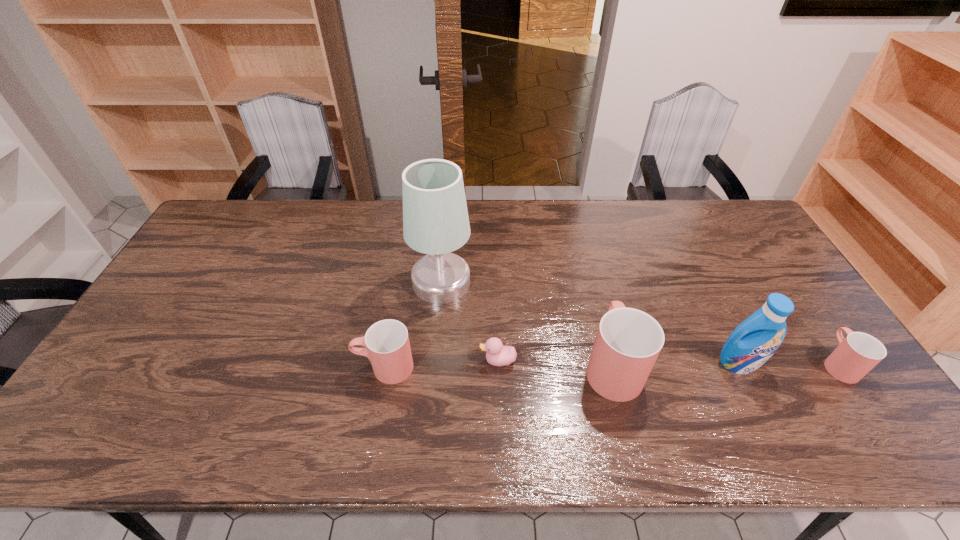
Locate an element on the screen. The image size is (960, 540). the leftmost cup is located at coordinates (387, 346).

I want to click on the fourth tallest object, so [x=387, y=346].

Where is `the fourth shortest object`? This screenshot has width=960, height=540. the fourth shortest object is located at coordinates [x=628, y=342].

Identify the location of the tallest cup. (628, 342).

You are a GUI agent. You are given a task and a screenshot of the screen. Output one action in this format:
    pyautogui.click(x=<x>, y=<y>)
    Task: Click on the shortest cup
    The width and height of the screenshot is (960, 540).
    Given the screenshot: What is the action you would take?
    pyautogui.click(x=857, y=354)

Locate an element on the screen. The height and width of the screenshot is (540, 960). the rightmost object is located at coordinates (857, 354).

You are a GUI agent. You are given a task and a screenshot of the screen. Output one action in this format:
    pyautogui.click(x=<x>, y=<y>)
    Task: Click on the lampshade
    
    Given the screenshot: What is the action you would take?
    pyautogui.click(x=435, y=218)

What are the coordinates of `the tallest object` in the screenshot? It's located at (435, 218).

You are a GUI agent. You are given a task and a screenshot of the screen. Output one action in this format:
    pyautogui.click(x=<x>, y=<y>)
    Task: Click on the detergent
    This screenshot has width=960, height=540.
    Given the screenshot: What is the action you would take?
    pyautogui.click(x=755, y=340)

Locate an element on the screen. The image size is (960, 540). the second tallest object is located at coordinates (755, 340).